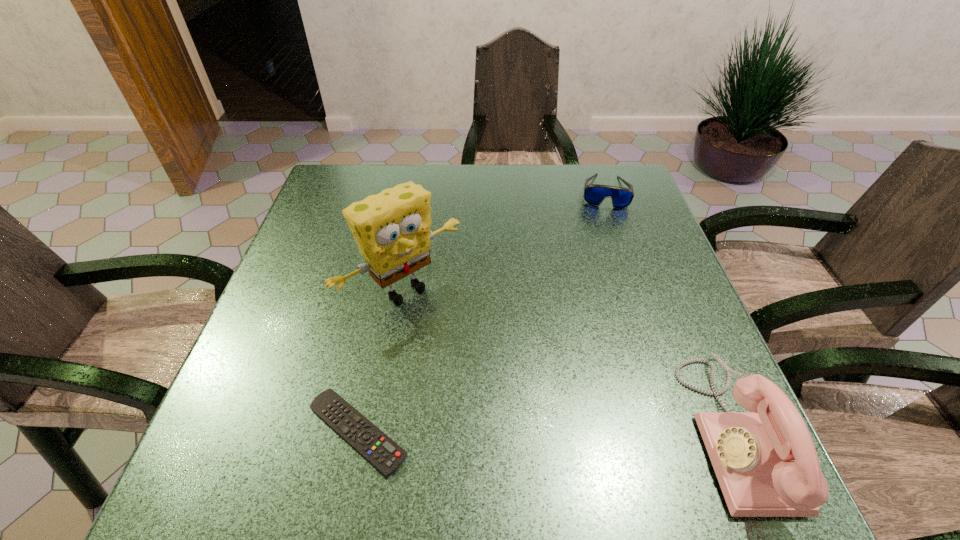
I want to click on free space at the far right corner of the desktop, so click(609, 185).

This screenshot has width=960, height=540. What are the coordinates of `unoccupied position between the sunglasses and the telephone` in the screenshot? It's located at (669, 312).

I want to click on empty space that is in between the second tallest object and the shortest object, so click(x=546, y=432).

Locate an element on the screen. This screenshot has height=540, width=960. vacant area that lies between the third shortest object and the shortest object is located at coordinates (546, 432).

Locate an element on the screen. The width and height of the screenshot is (960, 540). free point between the third nearest object and the farthest object is located at coordinates (504, 241).

This screenshot has width=960, height=540. What are the coordinates of `empty space that is in between the third tallest object and the tallest object` in the screenshot? It's located at point(504,241).

Identify the location of free space between the second shortest object and the remote control. (481, 312).

Where is `free space between the sponge and the telephone`? This screenshot has width=960, height=540. free space between the sponge and the telephone is located at coordinates (569, 361).

The image size is (960, 540). I want to click on free space that is in between the telephone and the remote control, so click(546, 432).

The image size is (960, 540). In order to click on vacant point located between the sunglasses and the second tallest object in this screenshot , I will do `click(669, 312)`.